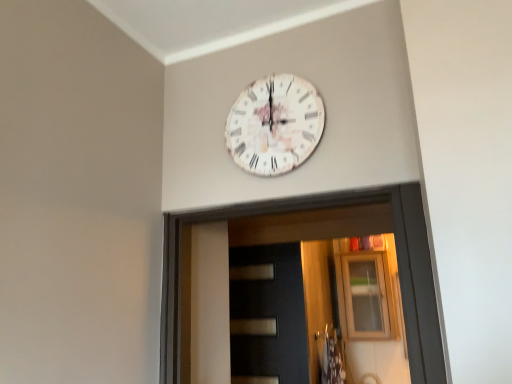
Question: Should I look upward or downward to see dark matte door at center?

Choices:
 (A) up
 (B) down

Answer: (B)

Question: Can you confirm if transparent glass cabinet at upper center is positioned to the right of dark matte door at center?

Choices:
 (A) yes
 (B) no

Answer: (A)

Question: From a real-world perspective, does transparent glass cabinet at upper center stand above dark matte door at center?

Choices:
 (A) no
 (B) yes

Answer: (B)

Question: Is transparent glass cabinet at upper center shorter than dark matte door at center?

Choices:
 (A) yes
 (B) no

Answer: (A)

Question: Can dark matte door at center be found inside transparent glass cabinet at upper center?

Choices:
 (A) yes
 (B) no

Answer: (B)

Question: Can you confirm if transparent glass cabinet at upper center is wider than dark matte door at center?

Choices:
 (A) yes
 (B) no

Answer: (A)

Question: From the image's perspective, is transparent glass cabinet at upper center below dark matte door at center?

Choices:
 (A) yes
 (B) no

Answer: (A)

Question: Is white paper-like clock at upper center touching dark matte door at center?

Choices:
 (A) yes
 (B) no

Answer: (B)

Question: Is the position of white paper-like clock at upper center less distant than that of dark matte door at center?

Choices:
 (A) yes
 (B) no

Answer: (A)

Question: Considering the relative positions of white paper-like clock at upper center and dark matte door at center in the image provided, is white paper-like clock at upper center to the left of dark matte door at center from the viewer's perspective?

Choices:
 (A) yes
 (B) no

Answer: (B)

Question: Does white paper-like clock at upper center have a smaller size compared to dark matte door at center?

Choices:
 (A) no
 (B) yes

Answer: (B)

Question: Is white paper-like clock at upper center to the right of dark matte door at center from the viewer's perspective?

Choices:
 (A) yes
 (B) no

Answer: (A)

Question: Is the position of white paper-like clock at upper center more distant than that of dark matte door at center?

Choices:
 (A) yes
 (B) no

Answer: (B)

Question: Is transparent glass cabinet at upper center smaller than white paper-like clock at upper center?

Choices:
 (A) yes
 (B) no

Answer: (B)